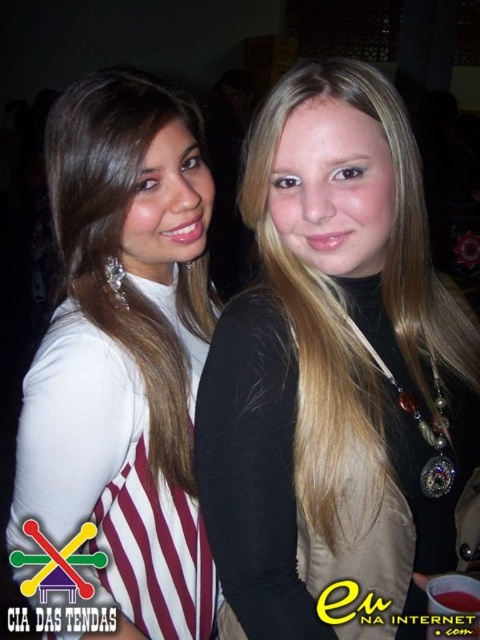
Question: Considering the relative positions of black matte vest at center and white matte dress at center in the image provided, where is black matte vest at center located with respect to white matte dress at center?

Choices:
 (A) right
 (B) left

Answer: (A)

Question: Which object is farther from the camera taking this photo?

Choices:
 (A) black matte vest at center
 (B) white matte dress at center

Answer: (B)

Question: Does black matte vest at center appear on the right side of white matte dress at center?

Choices:
 (A) yes
 (B) no

Answer: (A)

Question: Which of the following is the closest to the observer?

Choices:
 (A) black matte vest at center
 (B) white matte dress at center

Answer: (A)

Question: Which point is farther to the camera?

Choices:
 (A) white matte dress at center
 (B) black matte vest at center

Answer: (A)

Question: Is black matte vest at center above white matte dress at center?

Choices:
 (A) no
 (B) yes

Answer: (B)